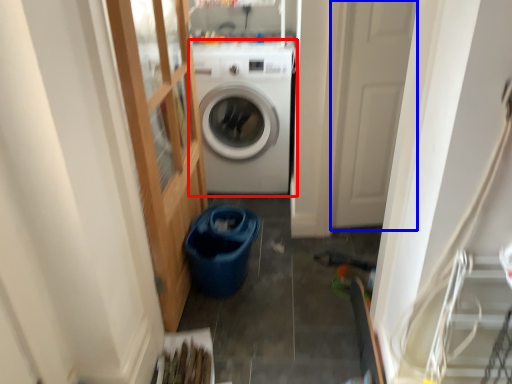
Question: Which of the following is the farthest to the observer, washing machine (highlighted by a red box) or screen door (highlighted by a blue box)?

Choices:
 (A) washing machine
 (B) screen door

Answer: (A)